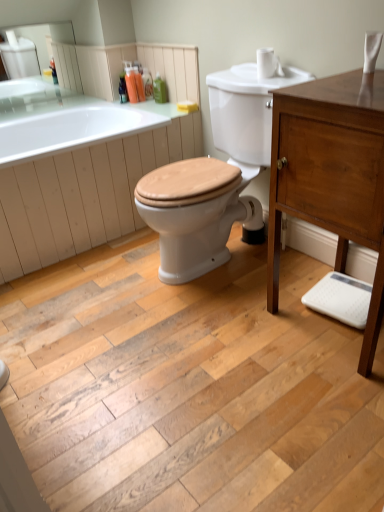
Locate an element on the screen. free spot in front of translucent plastic soap dispenser at upper center, placed as the fourth toiletry when sorted from right to left is located at coordinates (144, 103).